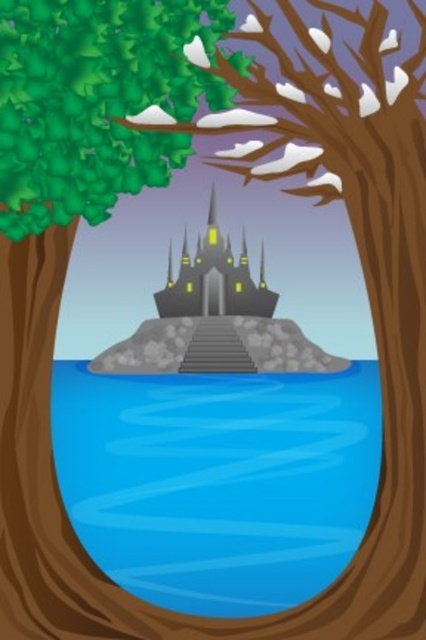
Who is taller, blue water at center or dark gray stone castle at center?

dark gray stone castle at center

Which of these two, blue water at center or dark gray stone castle at center, stands shorter?

blue water at center is shorter.

Which is in front, point (299, 566) or point (164, 307)?

Point (299, 566) is more forward.

This screenshot has width=426, height=640. Find the location of `blue water at center`. blue water at center is located at coordinates (218, 481).